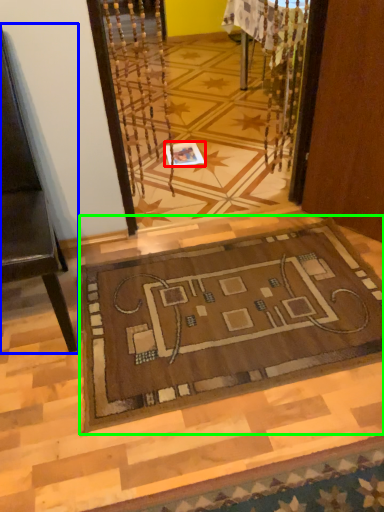
Question: Based on their relative distances, which object is farther from square (highlighted by a red box)? Choose from furniture (highlighted by a blue box) and mat (highlighted by a green box).

Choices:
 (A) furniture
 (B) mat

Answer: (A)